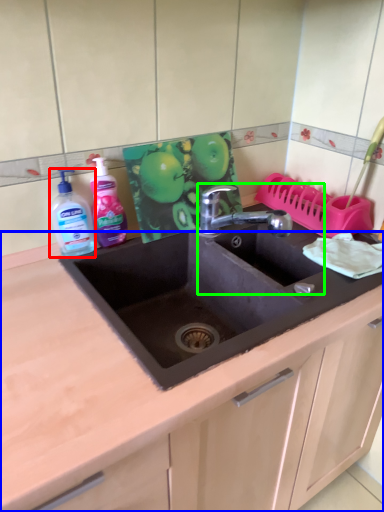
Question: Based on their relative distances, which object is farther from cleaning product (highlighted by a red box)? Choose from countertop (highlighted by a blue box) and sink (highlighted by a green box).

Choices:
 (A) countertop
 (B) sink

Answer: (B)